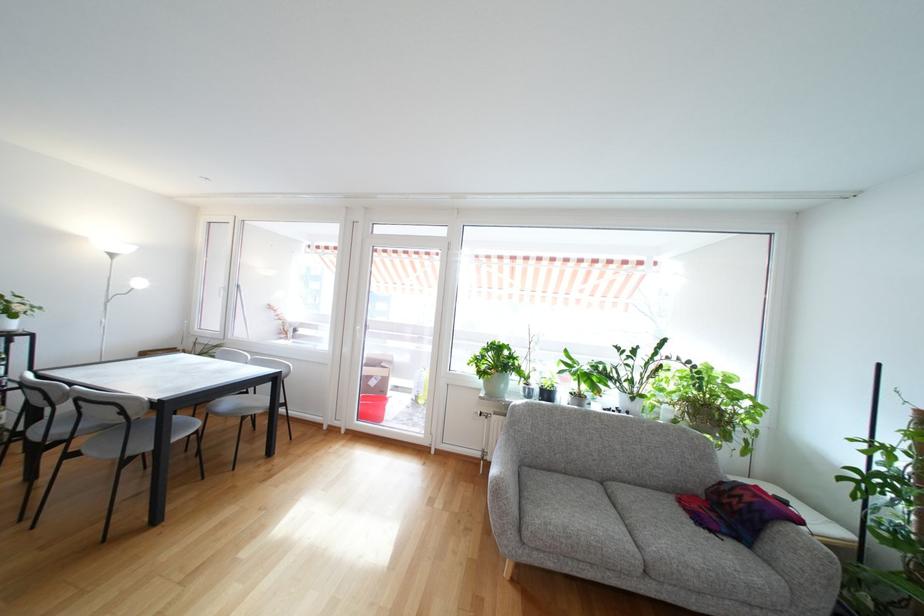
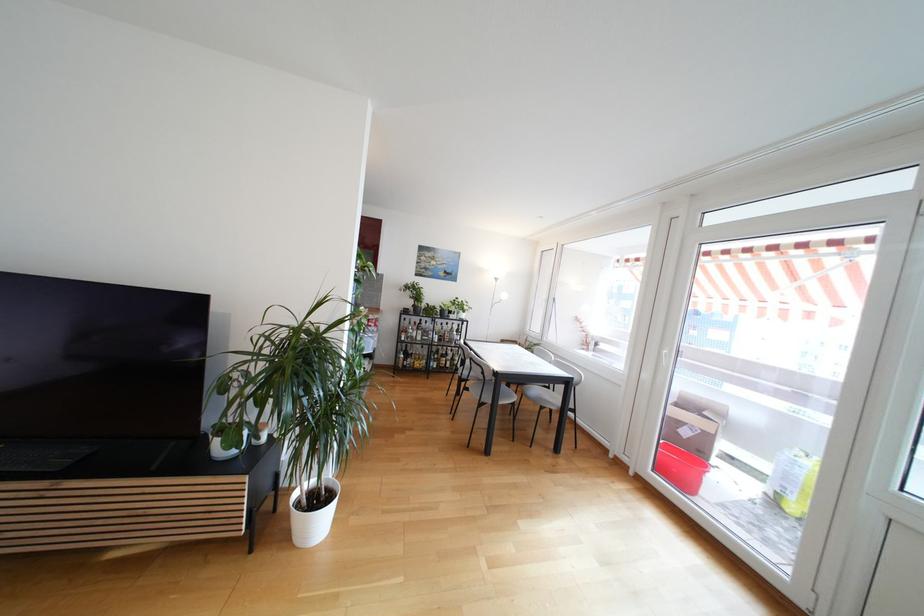
Question: The camera is either moving clockwise (left) or counter-clockwise (right) around the object. The first image is from the beginning of the video and the second image is from the end. Is the camera moving left or right when shooting the video?

Choices:
 (A) Left
 (B) Right

Answer: (B)